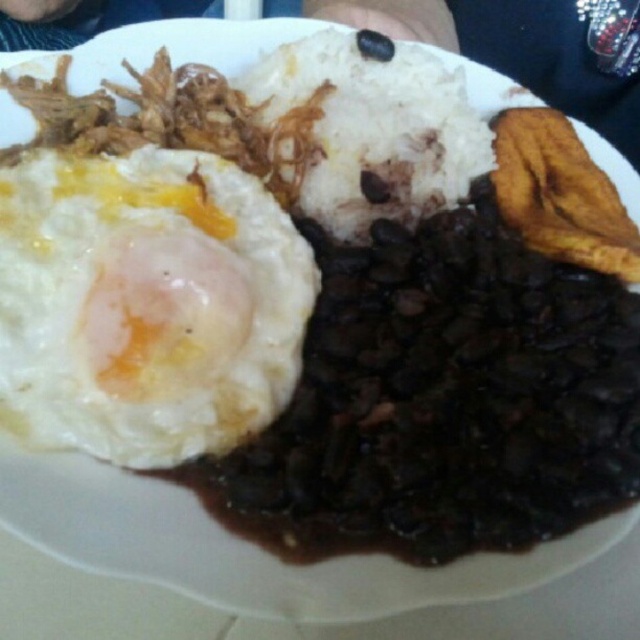
Where is `white fluffy egg at upper left`? The image size is (640, 640). white fluffy egg at upper left is located at coordinates (147, 305).

You are a GUI agent. You are given a task and a screenshot of the screen. Output one action in this format:
    pyautogui.click(x=<x>, y=<y>)
    Task: Click on the white fluffy egg at upper left
    
    Given the screenshot: What is the action you would take?
    pyautogui.click(x=147, y=305)

Measure the distance between point (x=131, y=236) and camera.

The distance of point (x=131, y=236) from camera is 32.03 inches.

This screenshot has width=640, height=640. In order to click on white fluffy egg at upper left in this screenshot , I will do `click(147, 305)`.

Which is behind, point (282, 157) or point (378, 54)?

Positioned behind is point (378, 54).

Which of these two, white matte rice at center or black matte bean at center, stands shorter?

With less height is black matte bean at center.

Does point (401, 220) come closer to viewer compared to point (376, 54)?

That is True.

You are a GUI agent. You are given a task and a screenshot of the screen. Output one action in this format:
    pyautogui.click(x=<x>, y=<y>)
    Task: Click on the white matte rice at center
    The height and width of the screenshot is (640, 640).
    Given the screenshot: What is the action you would take?
    point(369,131)